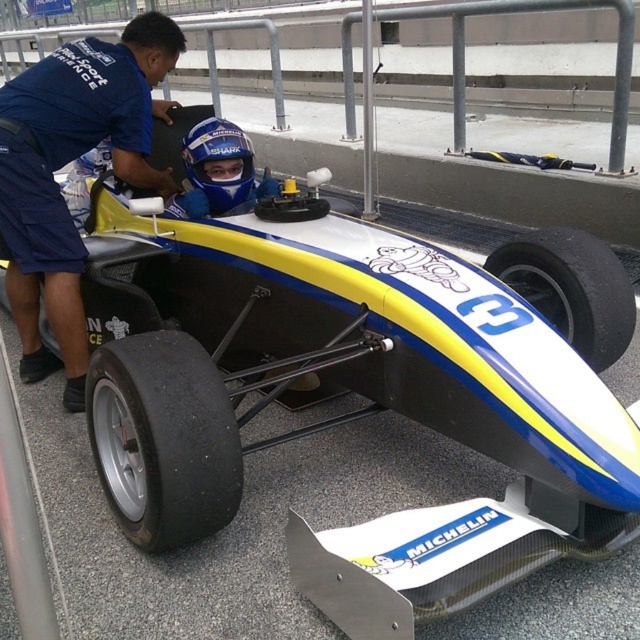
You are a photographer at the race track and want to capture a photo of the black rubber tire at lower center without the blue fabric shirt at left blocking it. What should you do?

Move to a position in front of the blue fabric shirt at left so that the black rubber tire at lower center is no longer blocked by it.

Looking at this image, you are a photographer at the race track. You need to capture the blue fabric shirt at left in your shot. What are the coordinates where you should focus your camera?

The blue fabric shirt at left is located at coordinates point (x=65, y=164).